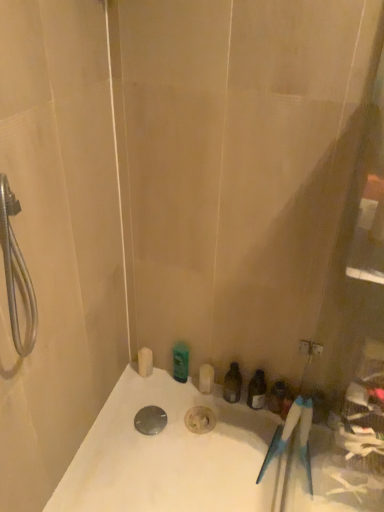
The width and height of the screenshot is (384, 512). I want to click on free space in front of green matte bottle at upper center, arranged as the 3th toiletry when viewed from the right, so point(176,415).